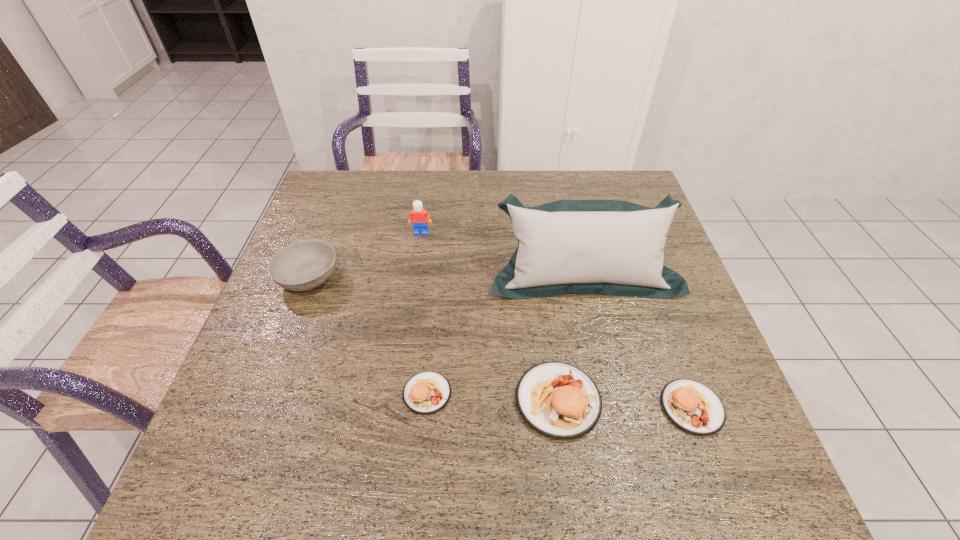
This screenshot has height=540, width=960. What are the coordinates of `vacant area between the rightmost patty and the bowl` in the screenshot? It's located at (500, 343).

Where is `empty location between the tallest object and the shortest patty`? The image size is (960, 540). empty location between the tallest object and the shortest patty is located at coordinates (506, 333).

You are a GUI agent. You are given a task and a screenshot of the screen. Output one action in this format:
    pyautogui.click(x=<x>, y=<y>)
    Task: Click on the empty location between the bowl and the cushion
    
    Given the screenshot: What is the action you would take?
    pyautogui.click(x=446, y=275)

Where is `vacant point located between the rightmost patty and the cushion`? The image size is (960, 540). vacant point located between the rightmost patty and the cushion is located at coordinates (x=637, y=340).

You are a GUI agent. You are given a task and a screenshot of the screen. Output one action in this format:
    pyautogui.click(x=<x>, y=<y>)
    Task: Click on the object that is the closest to the second shortest patty
    This screenshot has width=960, height=540.
    Given the screenshot: What is the action you would take?
    pyautogui.click(x=558, y=400)

In order to click on object that can be found as the fourth closest to the tallest object in this screenshot , I will do `click(693, 407)`.

Locate which patty ranks second in proximity to the second shortest patty. Please provide its 2D coordinates. Your answer should be formatted as a tuple, i.e. [(x, y)], where the tuple contains the x and y coordinates of a point satisfying the conditions above.

[(427, 392)]

Identify which patty is the second nearest to the shortest patty. Please provide its 2D coordinates. Your answer should be formatted as a tuple, i.e. [(x, y)], where the tuple contains the x and y coordinates of a point satisfying the conditions above.

[(693, 407)]

I want to click on vacant space that satisfies the following two spatial constraints: 1. on the front side of the second tallest patty; 2. on the left side of the bowl, so click(x=261, y=407).

You are a GUI agent. You are given a task and a screenshot of the screen. Output one action in this format:
    pyautogui.click(x=<x>, y=<y>)
    Task: Click on the free location that satisfies the following two spatial constraints: 1. on the front side of the leftmost object; 2. on the left side of the rightmost patty
    Image resolution: width=960 pixels, height=540 pixels.
    Given the screenshot: What is the action you would take?
    pyautogui.click(x=261, y=407)